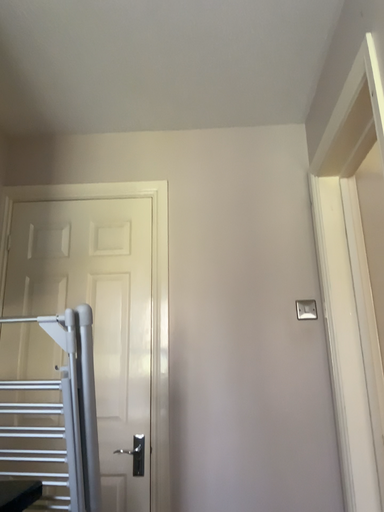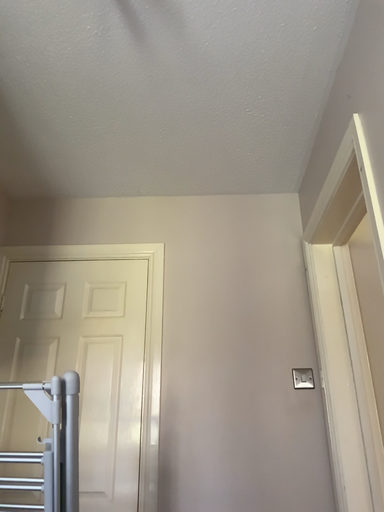
Question: How did the camera likely rotate when shooting the video?

Choices:
 (A) rotated upward
 (B) rotated downward

Answer: (A)